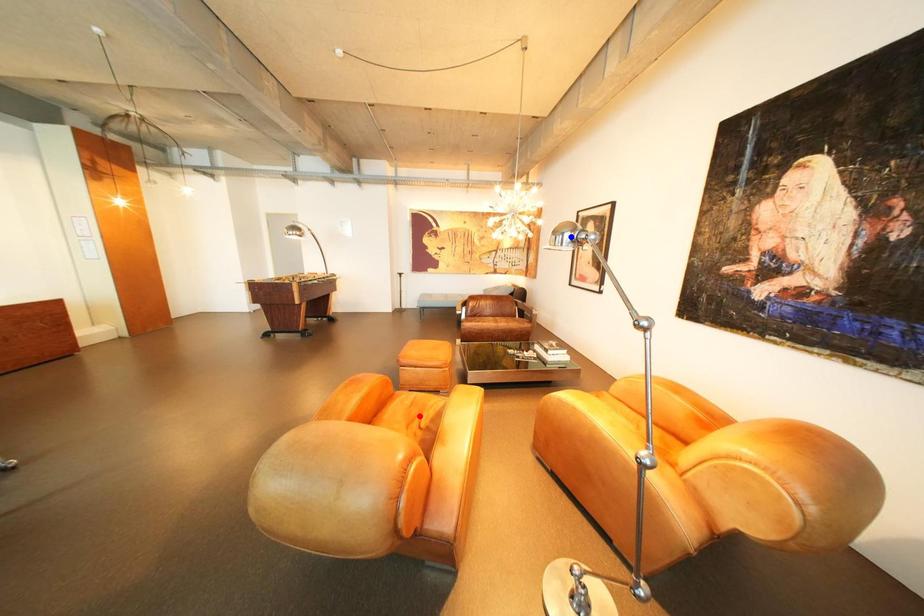
Question: In the image, two points are highlighted. Which point is nearer to the camera? Reply with the corresponding letter.

Choices:
 (A) blue point
 (B) red point

Answer: (B)